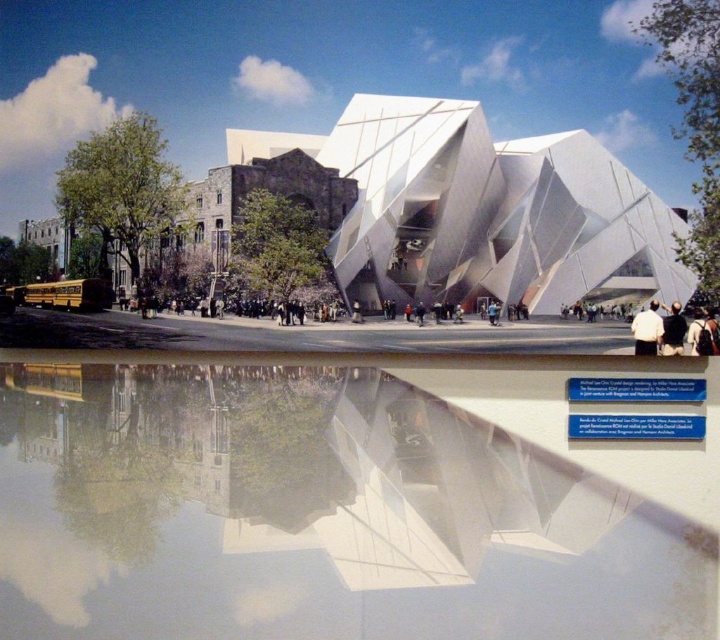
Does transparent glass water at center have a greater height compared to white matte shirt at center?

Yes.

Is transparent glass water at center smaller than white matte shirt at center?

No.

Measure the distance between transparent glass water at center and camera.

transparent glass water at center is 20.27 meters from camera.

Where is `transparent glass water at center`? transparent glass water at center is located at coordinates (315, 515).

Does transparent glass water at center have a smaller size compared to black hair at lower right?

Actually, transparent glass water at center might be larger than black hair at lower right.

Is point (485, 596) positioned before point (665, 326)?

Yes, it is.

Where is `transparent glass water at center`? The width and height of the screenshot is (720, 640). transparent glass water at center is located at coordinates (315, 515).

At what (x,y) coordinates should I click in order to perform the action: click on transparent glass water at center. Please return your answer as a coordinate pair (x, y). Looking at the image, I should click on (315, 515).

Does point (631, 324) lie in front of point (679, 323)?

No.

Measure the distance between white matte shirt at center and camera.

white matte shirt at center and camera are 34.32 meters apart from each other.

Which is in front, point (654, 353) or point (670, 344)?

Point (654, 353)

The image size is (720, 640). Identify the location of white matte shirt at center. (648, 330).